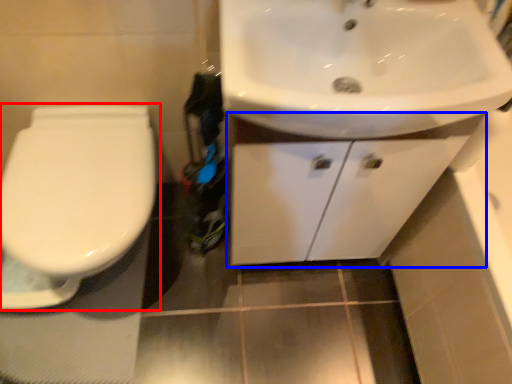
Question: Which of the following is the farthest to the observer, toilet (highlighted by a red box) or bathroom cabinet (highlighted by a blue box)?

Choices:
 (A) toilet
 (B) bathroom cabinet

Answer: (A)